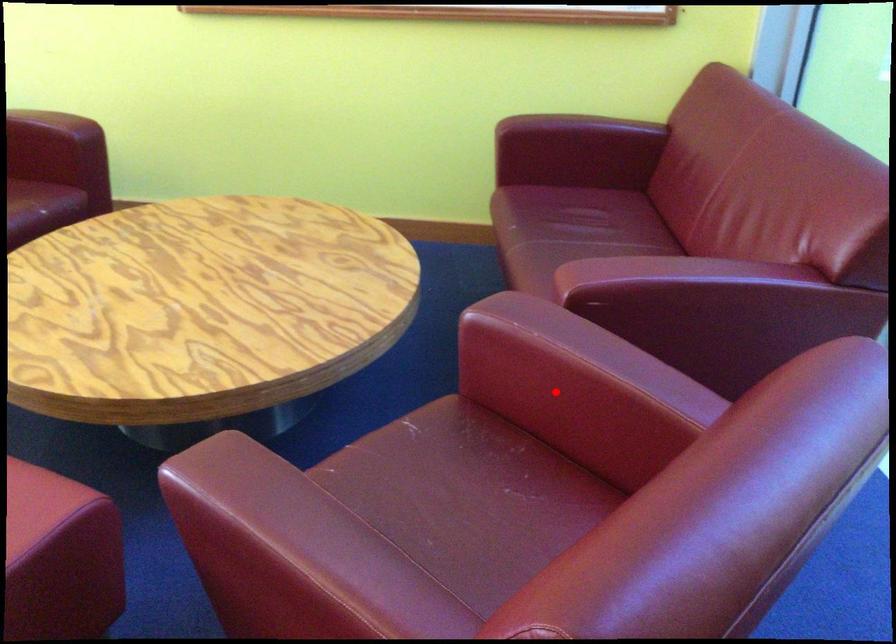
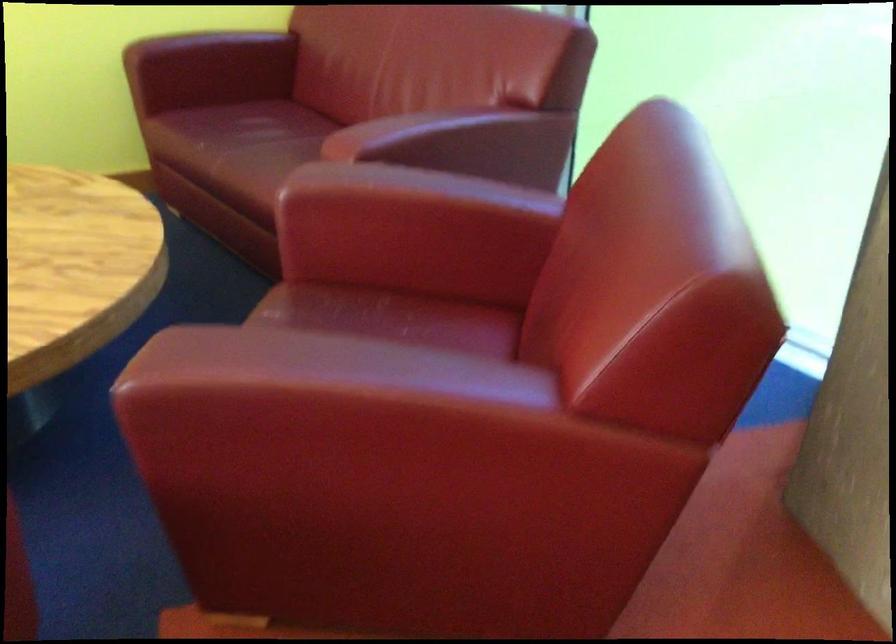
The point at the highlighted location is marked in the first image. Where is the corresponding point in the second image?

(412, 231)